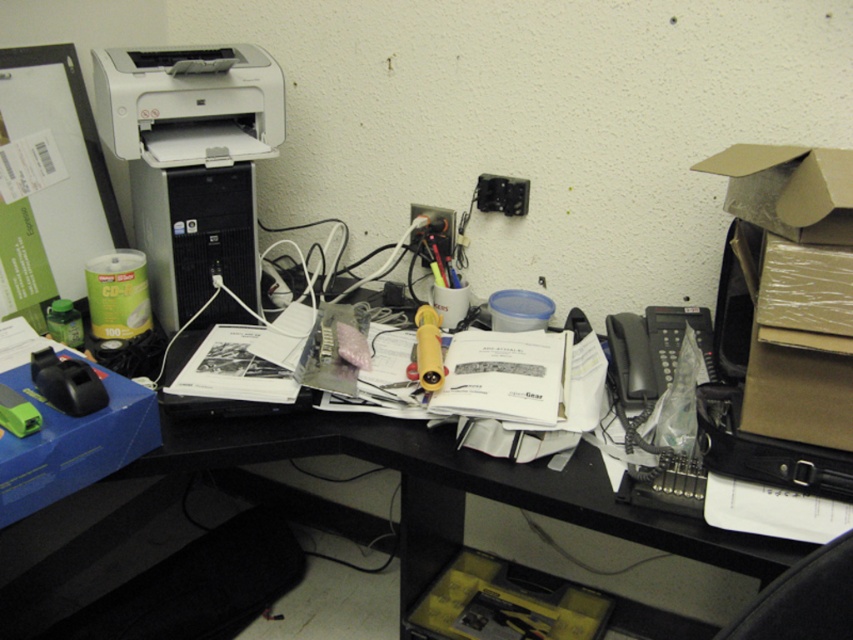
Question: Estimate the real-world distances between objects in this image. Which object is closer to the black plastic computer at upper left?

Choices:
 (A) white matte printer at upper left
 (B) silver/black plastic desktop computer at center-left
 (C) black plastic telephone at right

Answer: (C)

Question: Is white matte printer at upper left below black plastic computer at upper left?

Choices:
 (A) no
 (B) yes

Answer: (A)

Question: Which object appears farthest from the camera in this image?

Choices:
 (A) white matte printer at upper left
 (B) black plastic computer at upper left
 (C) silver/black plastic desktop computer at center-left
 (D) black plastic telephone at right

Answer: (C)

Question: Is black plastic computer at upper left thinner than black plastic telephone at right?

Choices:
 (A) yes
 (B) no

Answer: (B)

Question: Is black plastic computer at upper left wider than black plastic telephone at right?

Choices:
 (A) no
 (B) yes

Answer: (B)

Question: Based on their relative distances, which object is nearer to the silver/black plastic desktop computer at center-left?

Choices:
 (A) white matte printer at upper left
 (B) black plastic computer at upper left

Answer: (A)